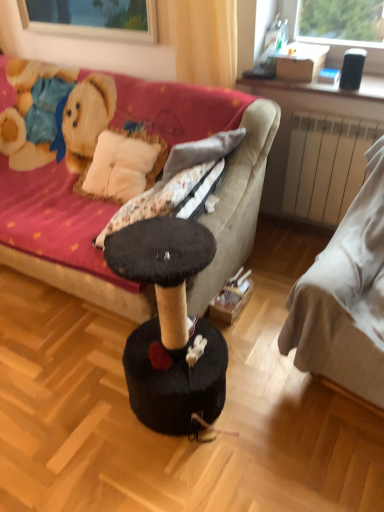
Question: From the image's perspective, is transparent glass window at upper center over yellow fabric curtain at upper center?

Choices:
 (A) no
 (B) yes

Answer: (B)

Question: Can you confirm if transparent glass window at upper center is positioned to the right of yellow fabric curtain at upper center?

Choices:
 (A) yes
 (B) no

Answer: (B)

Question: Could yellow fabric curtain at upper center be considered to be inside transparent glass window at upper center?

Choices:
 (A) no
 (B) yes

Answer: (A)

Question: Would you say transparent glass window at upper center is a long distance from yellow fabric curtain at upper center?

Choices:
 (A) yes
 (B) no

Answer: (B)

Question: Is transparent glass window at upper center next to yellow fabric curtain at upper center?

Choices:
 (A) no
 (B) yes

Answer: (A)

Question: Is transparent glass window at upper center not inside yellow fabric curtain at upper center?

Choices:
 (A) no
 (B) yes

Answer: (B)

Question: Is white matte radiator at right to the left of yellow fabric curtain at upper center from the viewer's perspective?

Choices:
 (A) yes
 (B) no

Answer: (B)

Question: From a real-world perspective, is white matte radiator at right on yellow fabric curtain at upper center?

Choices:
 (A) yes
 (B) no

Answer: (B)

Question: From a real-world perspective, is white matte radiator at right under yellow fabric curtain at upper center?

Choices:
 (A) yes
 (B) no

Answer: (A)

Question: Is white matte radiator at right facing away from yellow fabric curtain at upper center?

Choices:
 (A) yes
 (B) no

Answer: (B)

Question: Is white matte radiator at right beside yellow fabric curtain at upper center?

Choices:
 (A) no
 (B) yes

Answer: (A)

Question: Is white matte radiator at right to the right of yellow fabric curtain at upper center from the viewer's perspective?

Choices:
 (A) yes
 (B) no

Answer: (A)

Question: Considering the relative sizes of white fabric bed at right, acting as the first studio couch starting from the right, and white matte radiator at right in the image provided, is white fabric bed at right, acting as the first studio couch starting from the right, wider than white matte radiator at right?

Choices:
 (A) yes
 (B) no

Answer: (A)